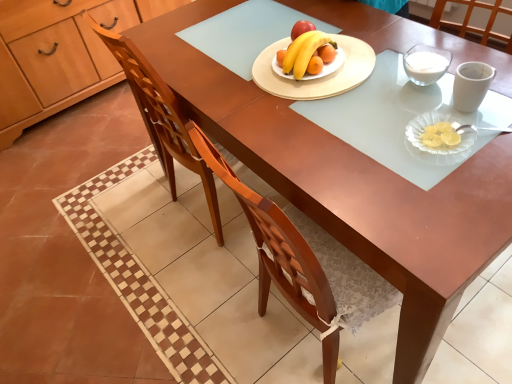
The height and width of the screenshot is (384, 512). I want to click on unoccupied region to the right of yellow matte banana at center, so click(375, 57).